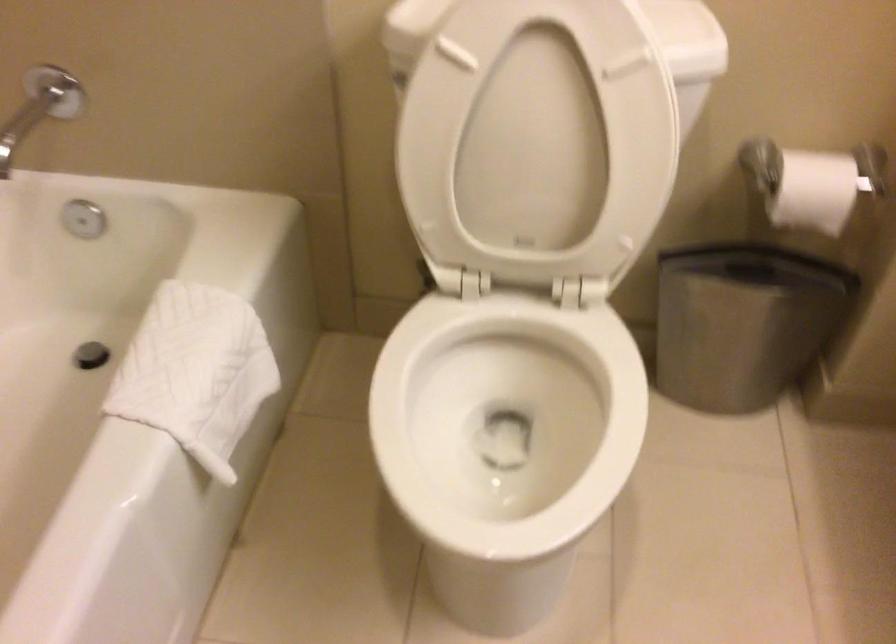
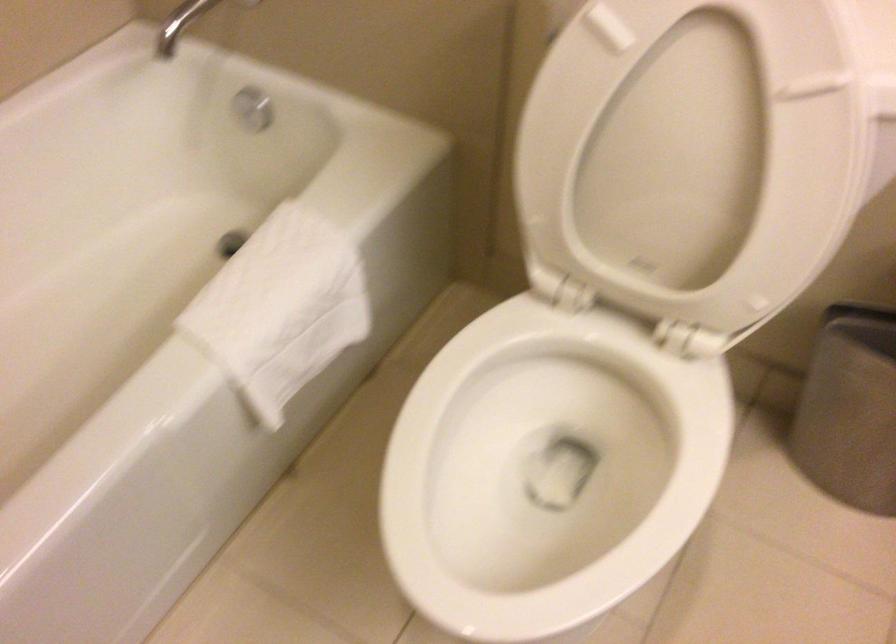
The point at (493, 444) is marked in the first image. Where is the corresponding point in the second image?

(547, 469)